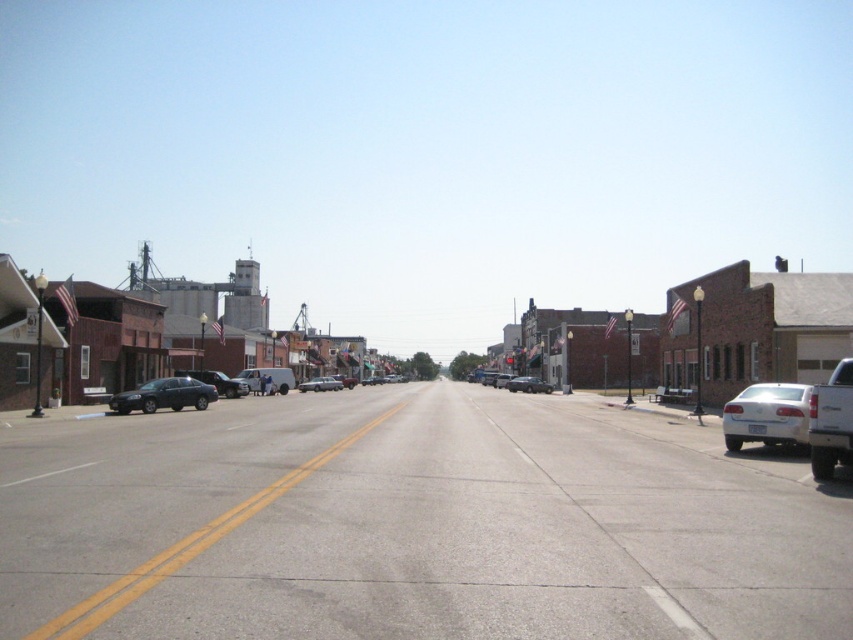
Question: Considering the real-world distances, which object is closest to the matte black sedan at left?

Choices:
 (A) silver metallic sedan at center
 (B) shiny black sedan at left
 (C) brown brick building at left
 (D) satin black sedan at center

Answer: (B)

Question: Is shiny black sedan at left wider than satin black sedan at center?

Choices:
 (A) yes
 (B) no

Answer: (A)

Question: Among these points, which one is farthest from the camera?

Choices:
 (A) (524, 380)
 (B) (61, 289)
 (C) (196, 384)

Answer: (A)

Question: Which point is farther from the camera taking this photo?

Choices:
 (A) (766, 442)
 (B) (544, 388)
 (C) (67, 291)
 (D) (146, 410)

Answer: (B)

Question: Does matte black sedan at left have a lesser width compared to shiny black sedan at left?

Choices:
 (A) yes
 (B) no

Answer: (B)

Question: Does matte black sedan at left appear on the right side of silver metallic sedan at center?

Choices:
 (A) yes
 (B) no

Answer: (B)